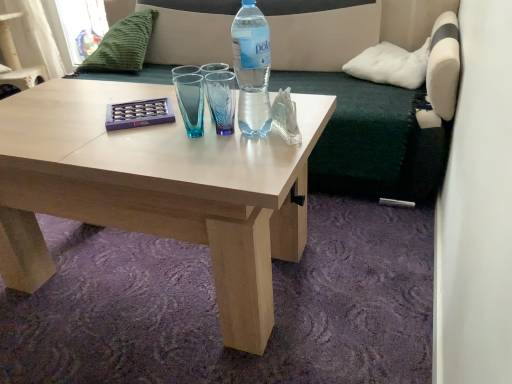
Image resolution: width=512 pixels, height=384 pixels. Describe the element at coordinates (17, 59) in the screenshot. I see `white fabric armchair at upper left` at that location.

The image size is (512, 384). What do you see at coordinates (252, 69) in the screenshot?
I see `translucent plastic bottle at center` at bounding box center [252, 69].

Describe the element at coordinates (391, 65) in the screenshot. The image size is (512, 384). I see `white soft pillow at upper right, arranged as the first pillow when viewed from the right` at that location.

The image size is (512, 384). Find the location of `light wood coffee table at center`. light wood coffee table at center is located at coordinates (156, 190).

Where is `white fabric armchair at upper left`? white fabric armchair at upper left is located at coordinates (17, 59).

From a real-world perspective, is white fabric armchair at upper left under green knitted pillow at upper left, which appears as the 1th pillow when viewed from the left?

Yes.

Would you say white fabric armchair at upper left contains green knitted pillow at upper left, arranged as the 2th pillow when viewed from the front?

No, green knitted pillow at upper left, arranged as the 2th pillow when viewed from the front, is not a part of white fabric armchair at upper left.

How much distance is there between white fabric armchair at upper left and green knitted pillow at upper left, acting as the second pillow starting from the right?

They are 3.78 feet apart.

Between white fabric armchair at upper left and green knitted pillow at upper left, which appears as the 1th pillow when viewed from the back, which one has more height?

With more height is white fabric armchair at upper left.

You are a GUI agent. You are given a task and a screenshot of the screen. Output one action in this format:
    pyautogui.click(x=<x>, y=<y>)
    Task: Click on the coffee table below the dark green fabric couch at upper center (from a real-world perspective)
    The image size is (512, 384).
    Given the screenshot: What is the action you would take?
    pyautogui.click(x=156, y=190)

From a real-world perspective, between light wood coffee table at center and dark green fabric couch at upper center, who is vertically higher?

dark green fabric couch at upper center.

How far apart are light wood coffee table at center and dark green fabric couch at upper center?

light wood coffee table at center is 31.80 inches away from dark green fabric couch at upper center.

Is light wood coffee table at center aimed at dark green fabric couch at upper center?

No, light wood coffee table at center is not aimed at dark green fabric couch at upper center.

From a real-world perspective, is white soft pillow at upper right, acting as the second pillow starting from the left, physically located above or below green knitted pillow at upper left, acting as the second pillow starting from the right?

white soft pillow at upper right, acting as the second pillow starting from the left, is situated lower than green knitted pillow at upper left, acting as the second pillow starting from the right, in the real world.

Considering the sizes of objects white soft pillow at upper right, the second pillow from the back, and green knitted pillow at upper left, which appears as the 1th pillow when viewed from the left, in the image provided, who is shorter, white soft pillow at upper right, the second pillow from the back, or green knitted pillow at upper left, which appears as the 1th pillow when viewed from the left,?

white soft pillow at upper right, the second pillow from the back.

From the image's perspective, which object appears higher, white soft pillow at upper right, the second pillow from the back, or green knitted pillow at upper left, which appears as the 1th pillow when viewed from the back?

From the image's view, green knitted pillow at upper left, which appears as the 1th pillow when viewed from the back, is above.

Does white soft pillow at upper right, acting as the second pillow starting from the left, appear on the left side of green knitted pillow at upper left, arranged as the 2th pillow when viewed from the front?

Incorrect, white soft pillow at upper right, acting as the second pillow starting from the left, is not on the left side of green knitted pillow at upper left, arranged as the 2th pillow when viewed from the front.

Can you see translucent plastic bottle at center touching light wood coffee table at center?

No.

Relative to light wood coffee table at center, is translucent plastic bottle at center in front or behind?

In the image, translucent plastic bottle at center appears behind light wood coffee table at center.

Is translucent plastic bottle at center facing away from light wood coffee table at center?

No.

Does translucent plastic bottle at center turn towards white fabric armchair at upper left?

No, translucent plastic bottle at center is not turned towards white fabric armchair at upper left.

Is translucent plastic bottle at center far from white fabric armchair at upper left?

Yes, translucent plastic bottle at center and white fabric armchair at upper left are quite far apart.

Which is in front, point (264, 101) or point (7, 27)?

The point (264, 101) is closer.

Is translucent plastic bottle at center closer to the viewer compared to white fabric armchair at upper left?

Yes, translucent plastic bottle at center is in front of white fabric armchair at upper left.

Could you tell me if light wood coffee table at center is turned towards white fabric armchair at upper left?

No, light wood coffee table at center is not turned towards white fabric armchair at upper left.

From a real-world perspective, does light wood coffee table at center stand above white fabric armchair at upper left?

No.

Which of these two, light wood coffee table at center or white fabric armchair at upper left, is smaller?

light wood coffee table at center is smaller.

What's the angular difference between white fabric armchair at upper left and white soft pillow at upper right, arranged as the first pillow when viewed from the front,'s facing directions?

They differ by 85.8 degrees in their facing directions.

From the image's perspective, does white fabric armchair at upper left appear lower than white soft pillow at upper right, arranged as the first pillow when viewed from the front?

Incorrect, from the image's perspective, white fabric armchair at upper left is higher than white soft pillow at upper right, arranged as the first pillow when viewed from the front.

From a real-world perspective, is white fabric armchair at upper left below white soft pillow at upper right, the second pillow from the back?

Indeed, from a real-world perspective, white fabric armchair at upper left is positioned beneath white soft pillow at upper right, the second pillow from the back.

This screenshot has width=512, height=384. What are the coordinates of `the 2nd pillow to the right of the white fabric armchair at upper left, counting from the anchor's position` in the screenshot? It's located at (391, 65).

The width and height of the screenshot is (512, 384). What are the coordinates of `pillow that is the 1st object located below the white fabric armchair at upper left (from the image's perspective)` in the screenshot? It's located at (122, 45).

Identify the location of studio couch that is above the light wood coffee table at center (from the image's perspective). This screenshot has width=512, height=384. (368, 100).

Considering their positions, is white soft pillow at upper right, arranged as the first pillow when viewed from the right, positioned further to translucent plastic bottle at center than green knitted pillow at upper left, which appears as the 1th pillow when viewed from the left?

Based on the image, green knitted pillow at upper left, which appears as the 1th pillow when viewed from the left, appears to be further to translucent plastic bottle at center.

From the image, which object appears to be nearer to white fabric armchair at upper left, dark green fabric couch at upper center or green knitted pillow at upper left, acting as the second pillow starting from the right?

green knitted pillow at upper left, acting as the second pillow starting from the right, is closer to white fabric armchair at upper left.

From the image, which object appears to be farther from green knitted pillow at upper left, arranged as the 2th pillow when viewed from the front, light wood coffee table at center or translucent plastic bottle at center?

Among the two, translucent plastic bottle at center is located further to green knitted pillow at upper left, arranged as the 2th pillow when viewed from the front.

Looking at the image, which one is located closer to translucent plastic bottle at center, white fabric armchair at upper left or light wood coffee table at center?

Based on the image, light wood coffee table at center appears to be nearer to translucent plastic bottle at center.

From the image, which object appears to be nearer to green knitted pillow at upper left, which appears as the 1th pillow when viewed from the back, light wood coffee table at center or white soft pillow at upper right, the second pillow from the back?

Among the two, light wood coffee table at center is located nearer to green knitted pillow at upper left, which appears as the 1th pillow when viewed from the back.

Based on their spatial positions, is white fabric armchair at upper left or light wood coffee table at center further from green knitted pillow at upper left, which appears as the 1th pillow when viewed from the back?

The object further to green knitted pillow at upper left, which appears as the 1th pillow when viewed from the back, is light wood coffee table at center.

When comparing their distances from light wood coffee table at center, does white fabric armchair at upper left or dark green fabric couch at upper center seem further?

The object further to light wood coffee table at center is white fabric armchair at upper left.

When comparing their distances from translucent plastic bottle at center, does dark green fabric couch at upper center or green knitted pillow at upper left, acting as the second pillow starting from the right, seem closer?

Among the two, dark green fabric couch at upper center is located nearer to translucent plastic bottle at center.

Find the location of a particular element. The image size is (512, 384). studio couch between translucent plastic bottle at center and green knitted pillow at upper left, arranged as the 2th pillow when viewed from the front, from front to back is located at coordinates (368, 100).

The width and height of the screenshot is (512, 384). Find the location of `studio couch between translucent plastic bottle at center and white soft pillow at upper right, arranged as the first pillow when viewed from the front, from front to back`. studio couch between translucent plastic bottle at center and white soft pillow at upper right, arranged as the first pillow when viewed from the front, from front to back is located at coordinates (368, 100).

You are a GUI agent. You are given a task and a screenshot of the screen. Output one action in this format:
    pyautogui.click(x=<x>, y=<y>)
    Task: Click on the studio couch located between green knitted pillow at upper left, which appears as the 1th pillow when viewed from the left, and white soft pillow at upper right, the second pillow from the back, in the left-right direction
    Image resolution: width=512 pixels, height=384 pixels.
    Given the screenshot: What is the action you would take?
    pyautogui.click(x=368, y=100)

Locate an element on the screen. bottle located between white fabric armchair at upper left and white soft pillow at upper right, arranged as the first pillow when viewed from the front, in the left-right direction is located at coordinates (252, 69).